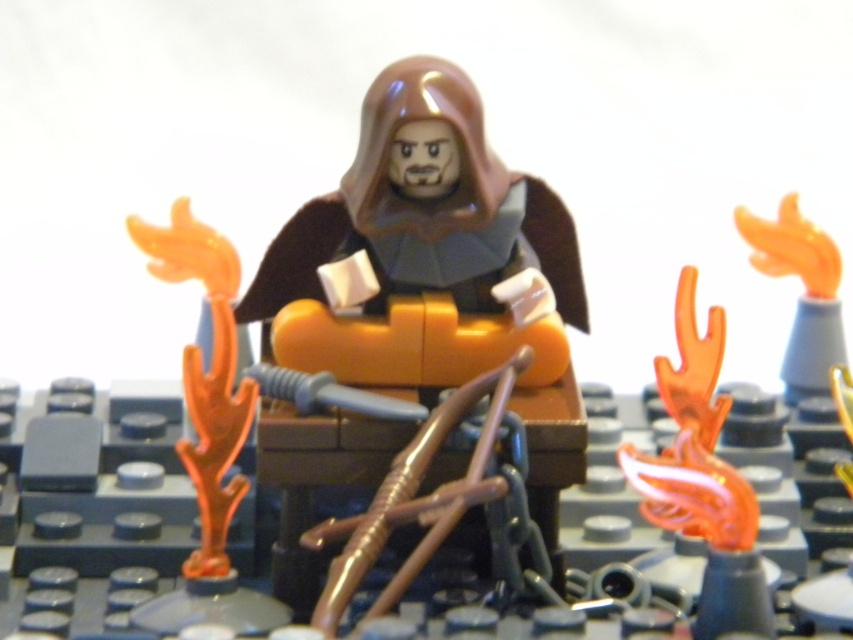
Question: Among these points, which one is farthest from the camera?

Choices:
 (A) (276, 278)
 (B) (813, 230)

Answer: (B)

Question: In this image, where is brown matte/soft robe at center located relative to translucent orange flame at upper right?

Choices:
 (A) right
 (B) left

Answer: (B)

Question: Considering the relative positions of brown matte/soft robe at center and translucent orange flame at upper right in the image provided, where is brown matte/soft robe at center located with respect to translucent orange flame at upper right?

Choices:
 (A) right
 (B) left

Answer: (B)

Question: Can you confirm if brown matte/soft robe at center is positioned above orange translucent flame at right?

Choices:
 (A) no
 (B) yes

Answer: (A)

Question: Estimate the real-world distances between objects in this image. Which object is closer to the translucent orange flame at upper right?

Choices:
 (A) orange translucent flame at right
 (B) brown matte/soft robe at center

Answer: (B)

Question: Which of the following is the farthest from the observer?

Choices:
 (A) pyautogui.click(x=548, y=532)
 (B) pyautogui.click(x=813, y=358)

Answer: (B)